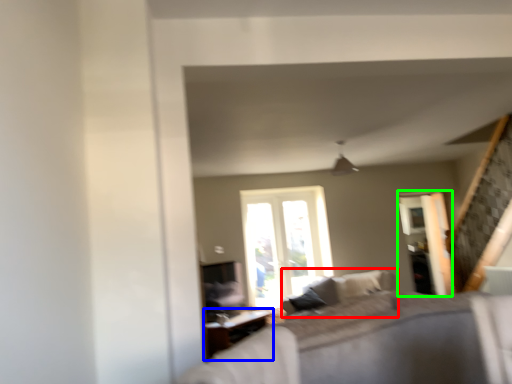
Question: Which object is the closest to the couch (highlighted by a red box)? Choose among these: table (highlighted by a blue box) or screen door (highlighted by a green box).

Choices:
 (A) table
 (B) screen door

Answer: (B)